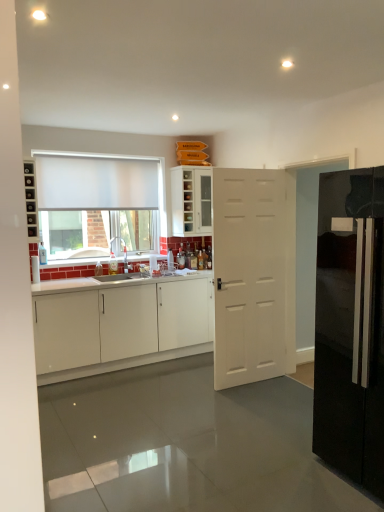
Question: Can you see matte black shelves at left touching glossy black refrigerator at right?

Choices:
 (A) yes
 (B) no

Answer: (B)

Question: From a real-world perspective, is matte black shelves at left physically above glossy black refrigerator at right?

Choices:
 (A) yes
 (B) no

Answer: (A)

Question: Does matte black shelves at left appear on the right side of glossy black refrigerator at right?

Choices:
 (A) yes
 (B) no

Answer: (B)

Question: Is matte black shelves at left completely or partially outside of glossy black refrigerator at right?

Choices:
 (A) yes
 (B) no

Answer: (A)

Question: Considering the relative sizes of matte black shelves at left and glossy black refrigerator at right in the image provided, is matte black shelves at left taller than glossy black refrigerator at right?

Choices:
 (A) no
 (B) yes

Answer: (A)

Question: Is glossy black refrigerator at right taller or shorter than white matte curtain at upper left?

Choices:
 (A) short
 (B) tall

Answer: (B)

Question: Looking at the image, does glossy black refrigerator at right seem bigger or smaller compared to white matte curtain at upper left?

Choices:
 (A) big
 (B) small

Answer: (A)

Question: Is glossy black refrigerator at right inside or outside of white matte curtain at upper left?

Choices:
 (A) outside
 (B) inside

Answer: (A)

Question: Relative to white matte curtain at upper left, is glossy black refrigerator at right in front or behind?

Choices:
 (A) behind
 (B) front

Answer: (B)

Question: In terms of size, does white matte door at center appear bigger or smaller than white glass cabinet at center, the 2th cabinetry when ordered from bottom to top?

Choices:
 (A) big
 (B) small

Answer: (A)

Question: From the image's perspective, relative to white glass cabinet at center, the 2th cabinetry when ordered from bottom to top, is white matte door at center above or below?

Choices:
 (A) above
 (B) below

Answer: (B)

Question: From a real-world perspective, is white matte door at center above or below white glass cabinet at center, positioned as the first cabinetry in top-to-bottom order?

Choices:
 (A) above
 (B) below

Answer: (B)

Question: Is point (231, 279) positioned closer to the camera than point (173, 215)?

Choices:
 (A) farther
 (B) closer

Answer: (B)

Question: Considering the positions of matte black shelves at left and white matte curtain at upper left in the image, is matte black shelves at left bigger or smaller than white matte curtain at upper left?

Choices:
 (A) big
 (B) small

Answer: (B)

Question: Considering the relative positions of matte black shelves at left and white matte curtain at upper left in the image provided, is matte black shelves at left to the left or to the right of white matte curtain at upper left?

Choices:
 (A) left
 (B) right

Answer: (A)